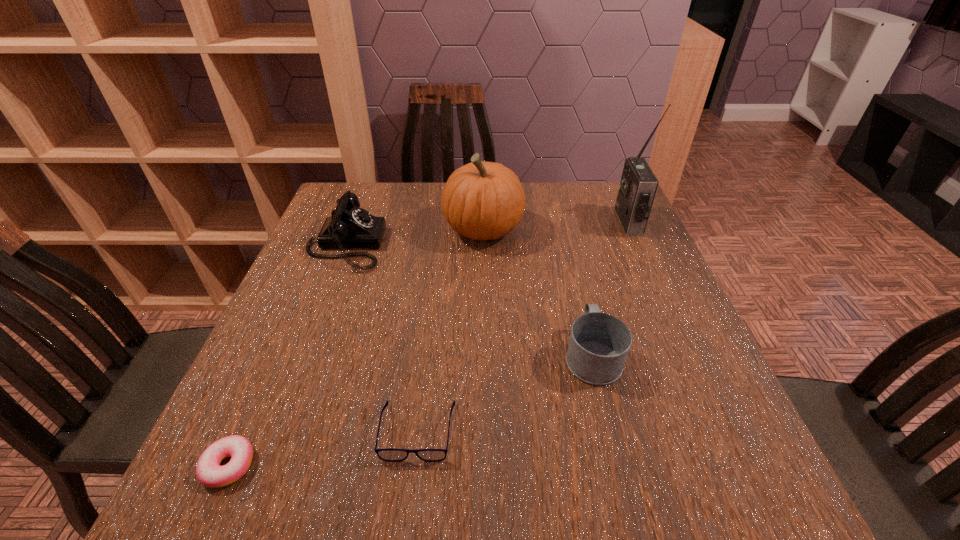
Locate an element on the screen. This screenshot has width=960, height=540. radio receiver that is at the far edge is located at coordinates (638, 185).

You are a GUI agent. You are given a task and a screenshot of the screen. Output one action in this format:
    pyautogui.click(x=<x>, y=<y>)
    Task: Click on the pumpkin that is at the far edge
    The image size is (960, 540).
    Given the screenshot: What is the action you would take?
    pyautogui.click(x=481, y=200)

This screenshot has width=960, height=540. Identify the location of telephone at the far edge. (349, 226).

The width and height of the screenshot is (960, 540). Identify the location of spectacles positioned at the near edge. (391, 455).

You are a GUI agent. You are given a task and a screenshot of the screen. Output one action in this format:
    pyautogui.click(x=<x>, y=<y>)
    Task: Click on the doughnut located at the near edge
    This screenshot has width=960, height=540.
    Given the screenshot: What is the action you would take?
    pyautogui.click(x=209, y=472)

What are the coordinates of `telephone located in the left edge section of the desktop` in the screenshot? It's located at (349, 226).

Identify the location of doughnut that is at the left edge. (209, 472).

Identify the location of object at the right edge. The image size is (960, 540). (638, 185).

I want to click on object that is at the far left corner, so pyautogui.click(x=349, y=226).

Identify the location of object that is at the near left corner. (209, 472).